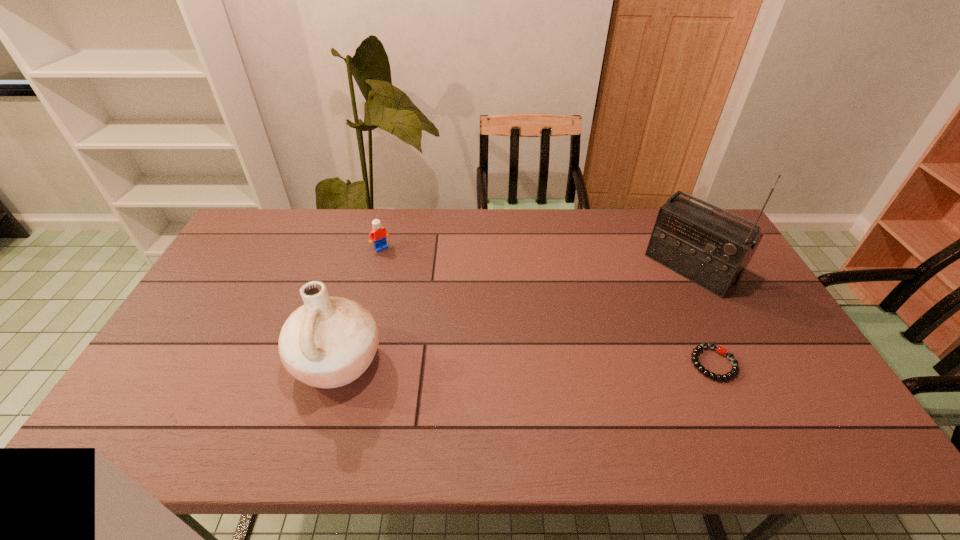
At what (x,y) coordinates should I click in order to perform the action: click on vacant space in between the third tallest object and the bracelet. Please return your answer as a coordinate pair (x, y). The width and height of the screenshot is (960, 540). Looking at the image, I should click on (547, 306).

Find the location of a particular element. This screenshot has height=540, width=960. free space between the bracelet and the Lego is located at coordinates (547, 306).

Where is `unoccupied position between the tallest object and the Lego`? The height and width of the screenshot is (540, 960). unoccupied position between the tallest object and the Lego is located at coordinates (536, 258).

Select which object appears as the closest to the shortest object. Please provide its 2D coordinates. Your answer should be formatted as a tuple, i.e. [(x, y)], where the tuple contains the x and y coordinates of a point satisfying the conditions above.

[(713, 251)]

The width and height of the screenshot is (960, 540). Identify the location of the second closest object relative to the Lego. (713, 251).